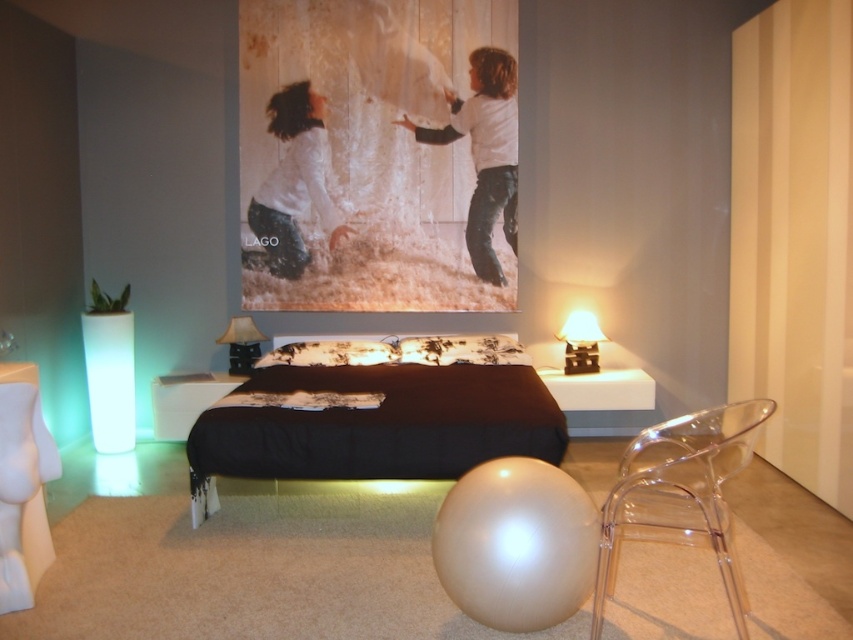
You are standing in the bedroom and want to sit down on the white glossy stool at lower center. However, there is a matte black lampshade at right in your way. Can you reach the stool without moving the lamp?

The white glossy stool at lower center is closer to the viewer than the matte black lampshade at right, so you can reach the stool without moving the lamp as it is nearer to you.

You are a guest in this bedroom and want to sit down to take off your shoes. You see a white glossy stool at lower center and a matte black lampshade at right. Which object should you sit on?

You should sit on the white glossy stool at lower center because it is a stool designed for sitting, while the matte black lampshade at right is part of a lamp and not meant for sitting.

Based on the photo, you are standing at the entrance of the bedroom and want to approach the black matte bed at center. Based on the coordinates provided, in which direction should you move from your current position to reach it?

The black matte bed at center is located at coordinates point [374,417], so you should move towards the center of the room to reach it.